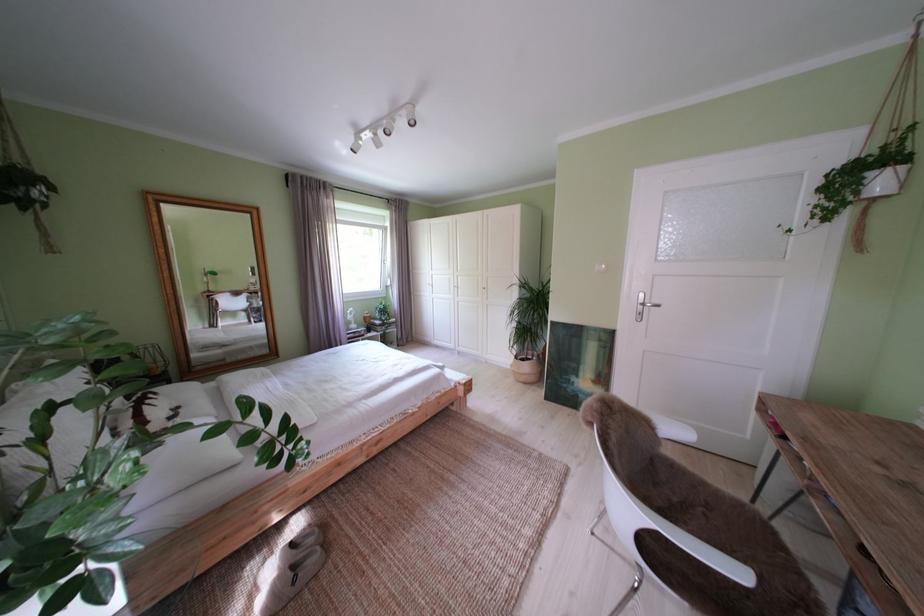
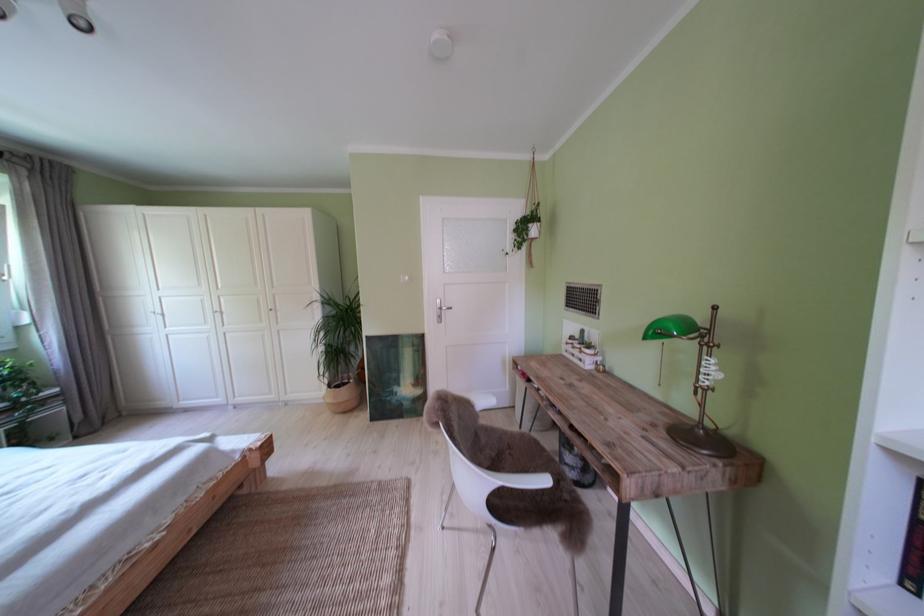
The point at (816, 207) is marked in the first image. Where is the corresponding point in the second image?

(520, 244)